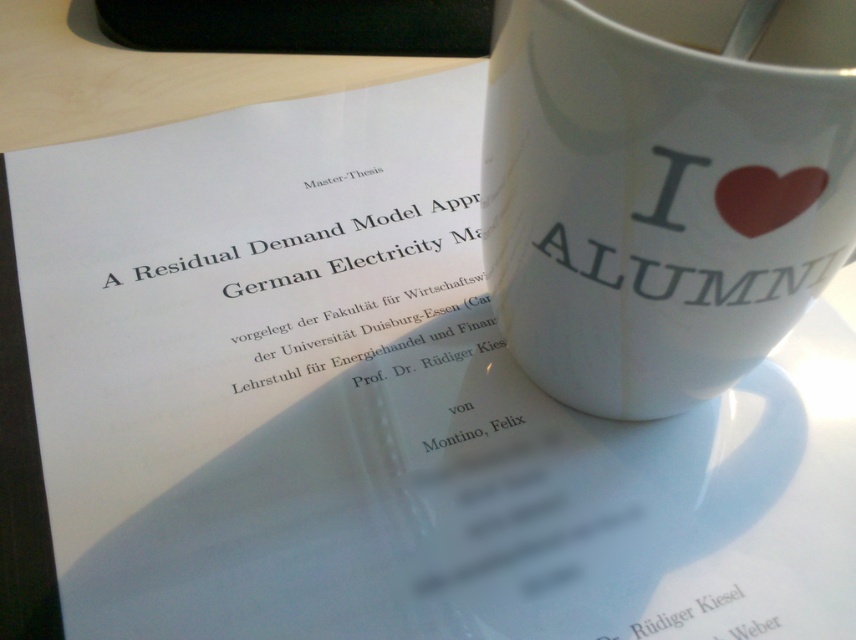
Question: Is white ceramic mug at upper right wider than white glossy mug at upper center?

Choices:
 (A) no
 (B) yes

Answer: (B)

Question: Which of the following is the farthest from the observer?

Choices:
 (A) (815, 4)
 (B) (733, 164)

Answer: (A)

Question: Which point is closer to the camera taking this photo?

Choices:
 (A) (675, 74)
 (B) (697, 0)

Answer: (A)

Question: Does white ceramic mug at upper right lie in front of white glossy mug at upper center?

Choices:
 (A) yes
 (B) no

Answer: (A)

Question: Can you confirm if white ceramic mug at upper right is positioned to the right of white glossy mug at upper center?

Choices:
 (A) no
 (B) yes

Answer: (A)